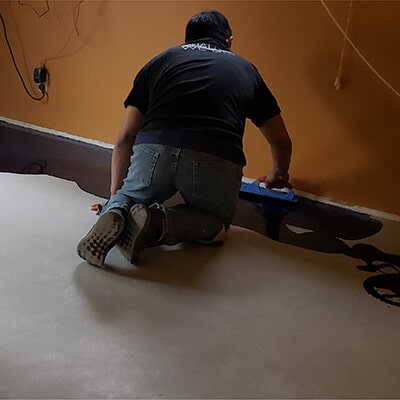
Identify the location of dark orange wall. (335, 143).